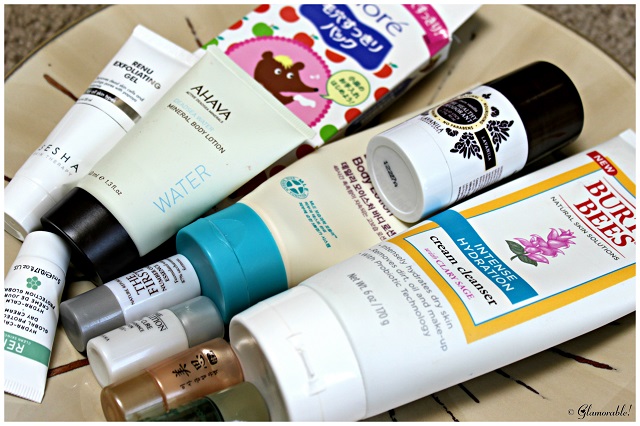
The height and width of the screenshot is (426, 640). Find the location of `ceramic dish`. ceramic dish is located at coordinates (34, 109), (125, 38), (509, 42), (438, 91), (605, 113), (596, 375), (495, 406), (64, 401), (67, 365).